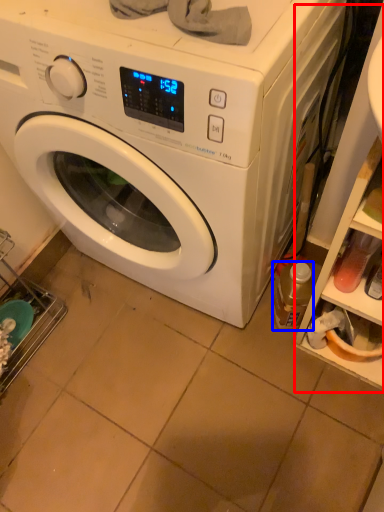
Question: Which of the following is the closest to the observer, shelf (highlighted by a red box) or bottle (highlighted by a blue box)?

Choices:
 (A) shelf
 (B) bottle

Answer: (A)